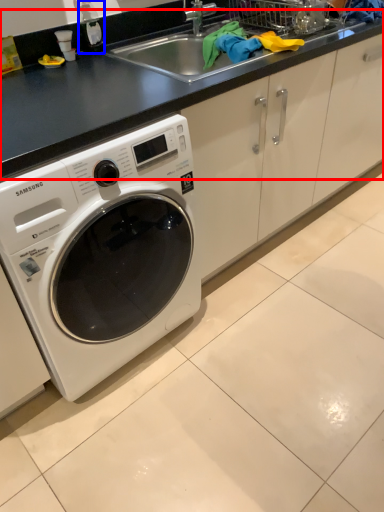
Question: Which object is further to the camera taking this photo, counter top (highlighted by a red box) or bottle (highlighted by a blue box)?

Choices:
 (A) counter top
 (B) bottle

Answer: (B)